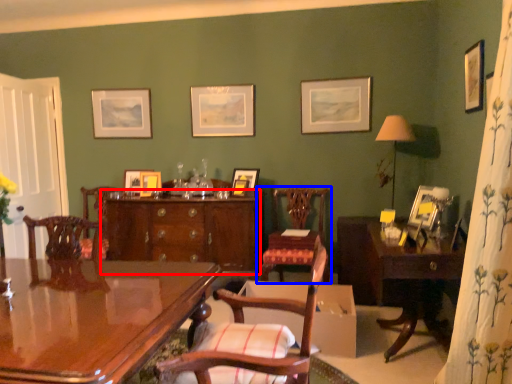
Question: Which object is further to the camera taking this photo, cabinetry (highlighted by a red box) or chair (highlighted by a blue box)?

Choices:
 (A) cabinetry
 (B) chair

Answer: (A)